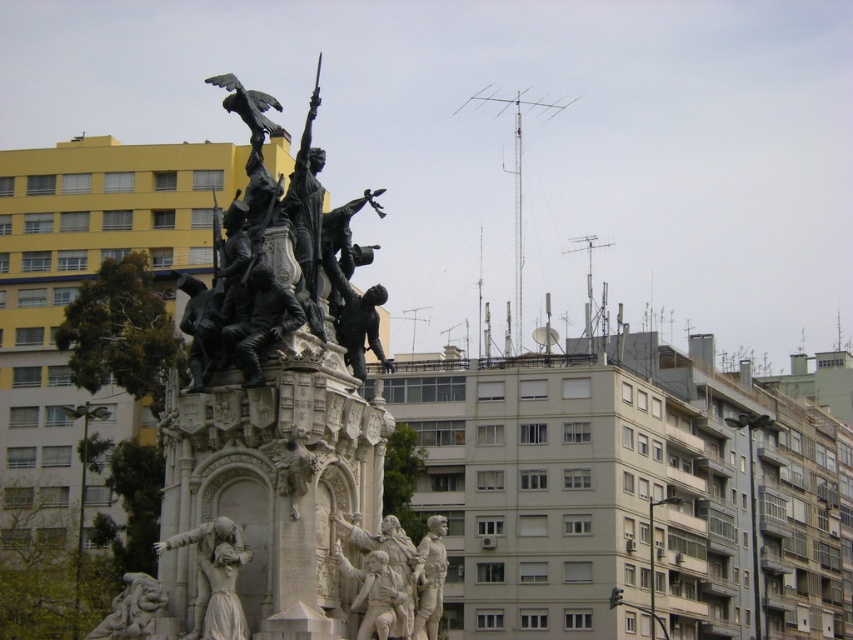
You are standing in the public square and want to take a photo of the bronze statue at center. If you are positioned at point A, which is at coordinates 0.5, 0.5, in which direction should you move to get a better view of the statue?

The bronze statue at center is located at point (281, 426). Since you are at (426, 320), you should move northeast to get a better view of the bronze statue at center.

You are a photographer planning to take a picture of the bronze statue at center and the white marble statue at lower left from a position where both are visible. Based on their positions, which statue will appear closer to the camera in the photo?

The bronze statue at center will appear closer to the camera because it is positioned over the white marble statue at lower left, meaning it is physically closer to the viewer.

You are standing in the public square and want to take a photo of the bronze statue at center. The statue is located at point (281,426). If you are currently at point 0.5, 0.5, which direction should you move to get closer to the bronze statue at center?

The bronze statue at center is located at point (281,426). Since you are at point 0.5, 0.5, you should move northeast to get closer to the bronze statue at center.